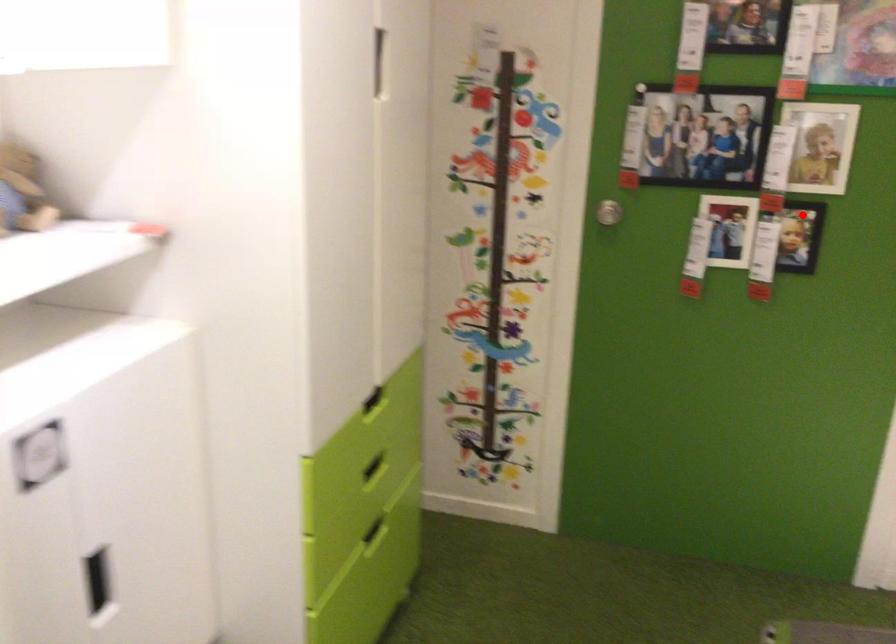
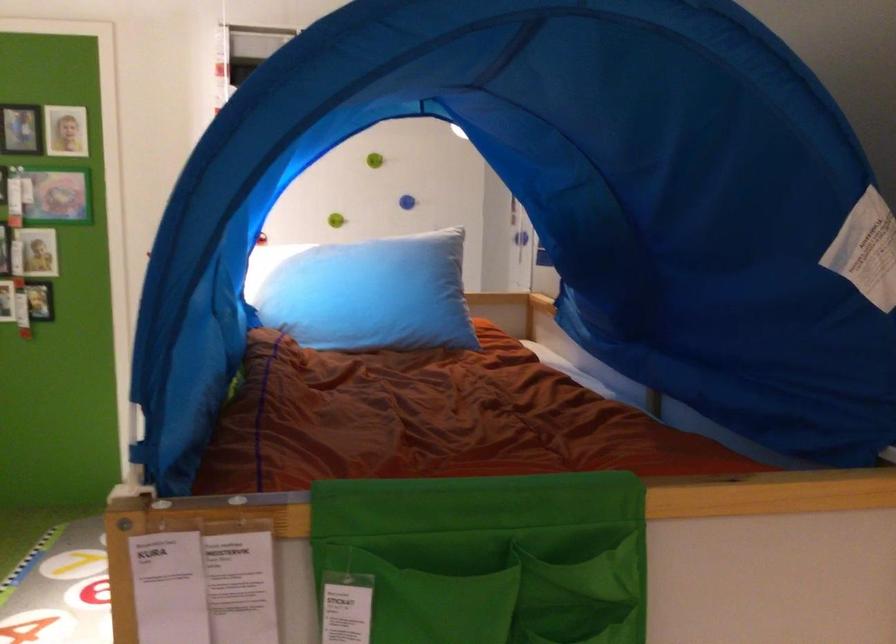
Question: I am providing you with two images of the same scene from different viewpoints. In image1, a red point is highlighted. Considering the same 3D point in image2, which of the following is correct?

Choices:
 (A) It is closer
 (B) It is farther

Answer: (B)